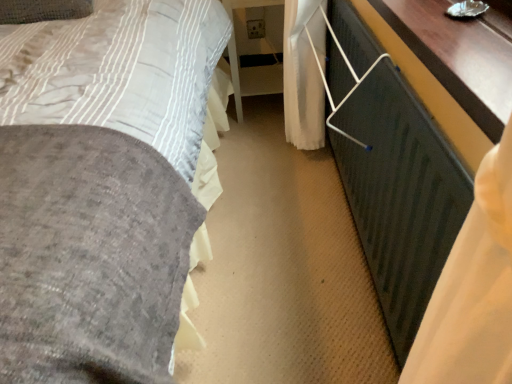
In order to face velvet gray bed at center, should I rotate leftwards or rightwards?

Rotate your view left by about 6.322°.

Identify the location of white glossy table at center, the 1th table in the left-to-right sequence. Image resolution: width=512 pixels, height=384 pixels. (234, 75).

In order to click on wooden table at right, the first table when ordered from right to left in this screenshot , I will do `click(457, 58)`.

Identify the location of velvet gray bed at center. The height and width of the screenshot is (384, 512). (100, 185).

Is white glossy table at center, the second table in the right-to-left sequence, at the right side of wooden table at right, the first table when ordered from right to left?

No, white glossy table at center, the second table in the right-to-left sequence, is not to the right of wooden table at right, the first table when ordered from right to left.

In the image, there is a wooden table at right, placed as the 1th table when sorted from front to back. At what (x,y) coordinates should I click in order to perform the action: click on table below it (from a real-world perspective). Please return your answer as a coordinate pair (x, y). Looking at the image, I should click on (234, 75).

Can you confirm if white glossy table at center, the 1th table in the left-to-right sequence, is bigger than wooden table at right, which appears as the 2th table when viewed from the back?

Yes.

Is metallic silver balustrade at lower right shorter than white glossy table at center, which is the 1th table from back to front?

No, metallic silver balustrade at lower right is not shorter than white glossy table at center, which is the 1th table from back to front.

This screenshot has height=384, width=512. There is a metallic silver balustrade at lower right. Find the location of `the 2nd table above it (from the image's perspective)`. the 2nd table above it (from the image's perspective) is located at coordinates (234, 75).

Does metallic silver balustrade at lower right have a lesser width compared to white glossy table at center, the second table in the right-to-left sequence?

Correct, the width of metallic silver balustrade at lower right is less than that of white glossy table at center, the second table in the right-to-left sequence.

Looking at this image, from the image's perspective, relative to white glossy table at center, the second table in the right-to-left sequence, is metallic silver balustrade at lower right above or below?

Based on their image positions, metallic silver balustrade at lower right is located beneath white glossy table at center, the second table in the right-to-left sequence.

Is white glossy table at center, which is the 1th table from back to front, not inside velvet gray bed at center?

Yes, white glossy table at center, which is the 1th table from back to front, is outside of velvet gray bed at center.

The height and width of the screenshot is (384, 512). There is a velvet gray bed at center. What are the coordinates of `the 2nd table above it (from the image's perspective)` in the screenshot? It's located at (234, 75).

Which object is positioned more to the right, white glossy table at center, the second table in the right-to-left sequence, or velvet gray bed at center?

From the viewer's perspective, white glossy table at center, the second table in the right-to-left sequence, appears more on the right side.

Is velvet gray bed at center facing towards white glossy table at center, the 2th table when ordered from front to back?

No, velvet gray bed at center does not turn towards white glossy table at center, the 2th table when ordered from front to back.

From a real-world perspective, is velvet gray bed at center located beneath white glossy table at center, which is the 1th table from back to front?

Yes, from a real-world perspective, velvet gray bed at center is below white glossy table at center, which is the 1th table from back to front.

Considering the sizes of objects velvet gray bed at center and white glossy table at center, which is the 1th table from back to front, in the image provided, who is wider, velvet gray bed at center or white glossy table at center, which is the 1th table from back to front,?

Wider between the two is velvet gray bed at center.

Can you confirm if velvet gray bed at center is bigger than white glossy table at center, the 1th table in the left-to-right sequence?

Yes.

Is velvet gray bed at center in front of or behind wooden table at right, the first table when ordered from right to left, in the image?

velvet gray bed at center is behind wooden table at right, the first table when ordered from right to left.

In the scene shown: Is velvet gray bed at center far away from wooden table at right, which is the 2th table in left-to-right order?

They are positioned close to each other.

In order to click on table that appears in front of the velvet gray bed at center in this screenshot , I will do `click(457, 58)`.

Is wooden table at right, the first table when ordered from right to left, taller than white glossy table at center, the second table in the right-to-left sequence?

No.

From the image's perspective, which one is positioned lower, wooden table at right, which is the 2th table in left-to-right order, or white glossy table at center, the 2th table when ordered from front to back?

wooden table at right, which is the 2th table in left-to-right order, from the image's perspective.

From a real-world perspective, is wooden table at right, which appears as the 2th table when viewed from the back, positioned under white glossy table at center, the 2th table when ordered from front to back, based on gravity?

No, from a real-world perspective, wooden table at right, which appears as the 2th table when viewed from the back, is not below white glossy table at center, the 2th table when ordered from front to back.

Is point (443, 54) positioned after point (227, 10)?

No, it is not.

Is white glossy table at center, which is the 1th table from back to front, further to the viewer compared to metallic silver balustrade at lower right?

Yes, white glossy table at center, which is the 1th table from back to front, is behind metallic silver balustrade at lower right.

Considering the sizes of objects white glossy table at center, the 1th table in the left-to-right sequence, and metallic silver balustrade at lower right in the image provided, who is taller, white glossy table at center, the 1th table in the left-to-right sequence, or metallic silver balustrade at lower right?

With more height is metallic silver balustrade at lower right.

Does white glossy table at center, the 1th table in the left-to-right sequence, have a larger size compared to metallic silver balustrade at lower right?

Indeed, white glossy table at center, the 1th table in the left-to-right sequence, has a larger size compared to metallic silver balustrade at lower right.

Where is `table above the wooden table at right, which is the 2th table in left-to-right order (from the image's perspective)`? table above the wooden table at right, which is the 2th table in left-to-right order (from the image's perspective) is located at coordinates (234, 75).

Where is `balustrade lying below the white glossy table at center, which is the 1th table from back to front (from the image's perspective)`? This screenshot has height=384, width=512. balustrade lying below the white glossy table at center, which is the 1th table from back to front (from the image's perspective) is located at coordinates (391, 173).

From the image, which object appears to be farther from velvet gray bed at center, wooden table at right, the first table when ordered from right to left, or metallic silver balustrade at lower right?

Among the two, wooden table at right, the first table when ordered from right to left, is located further to velvet gray bed at center.

Based on their spatial positions, is metallic silver balustrade at lower right or white glossy table at center, the 1th table in the left-to-right sequence, further from velvet gray bed at center?

A: The object further to velvet gray bed at center is white glossy table at center, the 1th table in the left-to-right sequence.

Based on their spatial positions, is white glossy table at center, the second table in the right-to-left sequence, or metallic silver balustrade at lower right further from wooden table at right, which is the 2th table in left-to-right order?

white glossy table at center, the second table in the right-to-left sequence, is positioned further to the anchor wooden table at right, which is the 2th table in left-to-right order.

Looking at the image, which one is located closer to velvet gray bed at center, metallic silver balustrade at lower right or wooden table at right, the first table when ordered from right to left?

metallic silver balustrade at lower right is positioned closer to the anchor velvet gray bed at center.

When comparing their distances from velvet gray bed at center, does wooden table at right, which appears as the 2th table when viewed from the back, or white glossy table at center, the 2th table when ordered from front to back, seem further?

white glossy table at center, the 2th table when ordered from front to back, is further to velvet gray bed at center.

Based on their spatial positions, is metallic silver balustrade at lower right or velvet gray bed at center further from wooden table at right, placed as the 1th table when sorted from front to back?

velvet gray bed at center lies further to wooden table at right, placed as the 1th table when sorted from front to back, than the other object.

Which object lies nearer to the anchor point wooden table at right, placed as the 1th table when sorted from front to back, metallic silver balustrade at lower right or white glossy table at center, the second table in the right-to-left sequence?

metallic silver balustrade at lower right lies closer to wooden table at right, placed as the 1th table when sorted from front to back, than the other object.

Based on their spatial positions, is velvet gray bed at center or white glossy table at center, the second table in the right-to-left sequence, further from metallic silver balustrade at lower right?

white glossy table at center, the second table in the right-to-left sequence, is further to metallic silver balustrade at lower right.

The height and width of the screenshot is (384, 512). I want to click on bed between metallic silver balustrade at lower right and white glossy table at center, the second table in the right-to-left sequence, in the front-back direction, so click(100, 185).

Locate an element on the screen. This screenshot has height=384, width=512. table between metallic silver balustrade at lower right and white glossy table at center, the second table in the right-to-left sequence, in the front-back direction is located at coordinates (457, 58).

You are a GUI agent. You are given a task and a screenshot of the screen. Output one action in this format:
    pyautogui.click(x=<x>, y=<y>)
    Task: Click on the bed between wooden table at right, which is the 2th table in left-to-right order, and white glossy table at center, the 1th table in the left-to-right sequence, in the front-back direction
    This screenshot has width=512, height=384.
    Given the screenshot: What is the action you would take?
    pyautogui.click(x=100, y=185)

Locate an element on the screen. This screenshot has width=512, height=384. balustrade between velvet gray bed at center and wooden table at right, placed as the 1th table when sorted from front to back, from left to right is located at coordinates (391, 173).